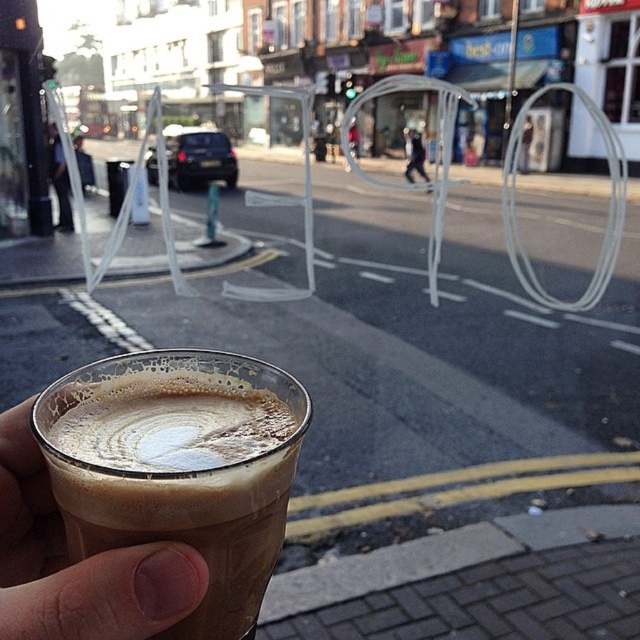
Question: Is translucent glass cup at lower left positioned behind dark blue jeans at left?

Choices:
 (A) yes
 (B) no

Answer: (B)

Question: Among these points, which one is nearest to the camera?

Choices:
 (A) (408, 141)
 (B) (33, 538)

Answer: (B)

Question: Is foamy brown latte at lower left wider than dark blue jeans at left?

Choices:
 (A) yes
 (B) no

Answer: (A)

Question: Is dark blue jeans at left bigger than dark blue jeans at center?

Choices:
 (A) yes
 (B) no

Answer: (A)

Question: Which object is the closest to the translucent glass cup at lower left?

Choices:
 (A) dark blue jeans at left
 (B) dark blue jeans at center
 (C) foamy brown latte at lower left

Answer: (C)

Question: Which of the following is the farthest from the observer?

Choices:
 (A) foamy brown latte at lower left
 (B) dark blue jeans at center
 (C) translucent glass cup at lower left

Answer: (B)